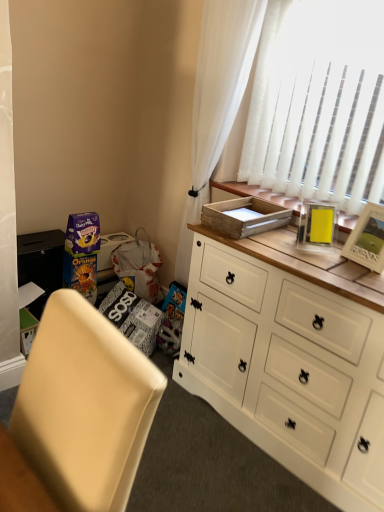
Question: Would you say matte cardboard box at lower left is to the left or to the right of wooden tray at upper right in the picture?

Choices:
 (A) left
 (B) right

Answer: (A)

Question: From a real-world perspective, relative to wooden tray at upper right, is matte cardboard box at lower left vertically above or below?

Choices:
 (A) above
 (B) below

Answer: (B)

Question: Based on their relative distances, which object is nearer to the beige fabric chair at lower left?

Choices:
 (A) wooden tray at upper right
 (B) matte cardboard box at lower left
 (C) wooden picture frame at upper right
 (D) white wood cabinet at center
 (E) white sheer curtain at upper right

Answer: (D)

Question: Which object is positioned closest to the wooden picture frame at upper right?

Choices:
 (A) white sheer curtain at upper right
 (B) white wood cabinet at center
 (C) matte cardboard box at lower left
 (D) beige fabric chair at lower left
 (E) wooden tray at upper right

Answer: (E)